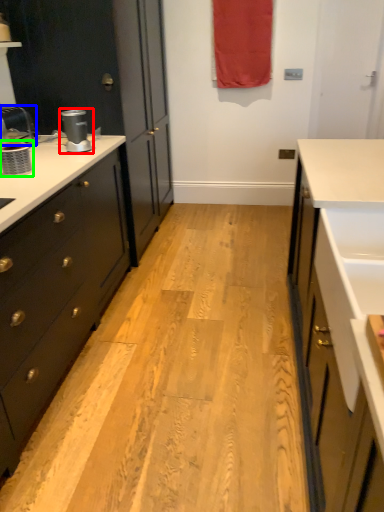
Question: Which is farther away from coffee machine (highlighted by a red box)? faucet (highlighted by a blue box) or appliance (highlighted by a green box)?

Choices:
 (A) faucet
 (B) appliance

Answer: (B)